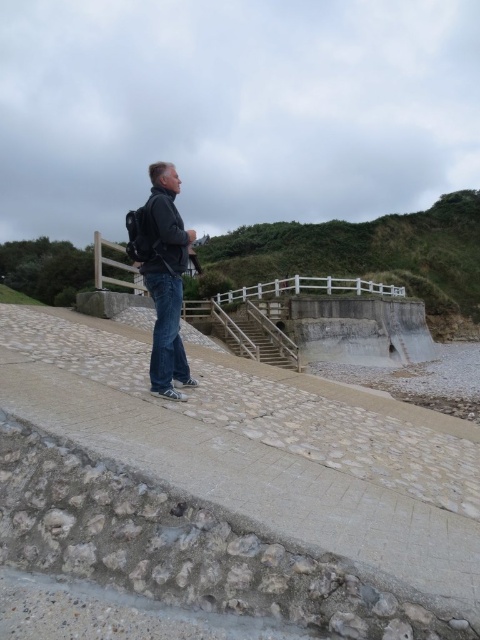
What do you see at coordinates (163, 275) in the screenshot? Image resolution: width=480 pixels, height=640 pixels. I see `matte black backpack at center` at bounding box center [163, 275].

Between point (160, 273) and point (165, 314), which one is positioned behind?

Point (165, 314)

Locate an element on the screen. This screenshot has width=480, height=640. matte black backpack at center is located at coordinates (163, 275).

Who is lower down, smooth concrete at center or matte black backpack at center?

smooth concrete at center is below.

Measure the distance between point (248, 480) and camera.

Point (248, 480) and camera are 8.87 feet apart from each other.

Who is more distant from viewer, (159, 484) or (168, 317)?

Point (168, 317)

Find the location of `smooth concrete at center`. smooth concrete at center is located at coordinates (233, 488).

Does smooth concrete at center have a greater width compared to denim at center?

Yes, smooth concrete at center is wider than denim at center.

Between smooth concrete at center and denim at center, which one has more height?

Standing taller between the two is denim at center.

Does point (126, 406) come in front of point (171, 358)?

Yes, it is.

Locate an element on the screen. smooth concrete at center is located at coordinates (233, 488).